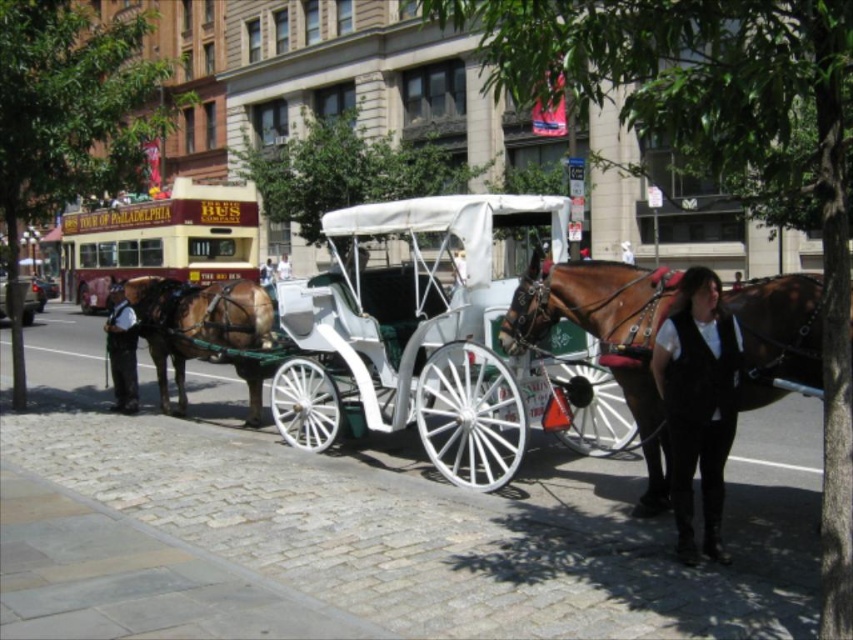
Is point (728, 381) more distant than point (248, 403)?

No, it is in front of (248, 403).

Which is above, white polished wood coach at center or brown glossy horse at left?

Positioned higher is white polished wood coach at center.

Is point (712, 397) closer to viewer compared to point (209, 292)?

Yes, point (712, 397) is closer to viewer.

Identify the location of white polished wood coach at center. The width and height of the screenshot is (853, 640). (698, 403).

Can you confirm if brown glossy horse at center is positioned to the left of white polished wood coach at center?

No, brown glossy horse at center is not to the left of white polished wood coach at center.

Does brown glossy horse at center come in front of white polished wood coach at center?

No, it is behind white polished wood coach at center.

Who is more forward, (573, 280) or (733, 339)?

Point (733, 339) is more forward.

Locate an element on the screen. The height and width of the screenshot is (640, 853). brown glossy horse at center is located at coordinates (606, 339).

Is white polished wood horse cart at center closer to camera compared to brown glossy horse at left?

Yes, it is in front of brown glossy horse at left.

Is white polished wood horse cart at center to the right of brown glossy horse at left from the viewer's perspective?

Indeed, white polished wood horse cart at center is positioned on the right side of brown glossy horse at left.

Find the location of a particular element. This screenshot has width=853, height=640. white polished wood horse cart at center is located at coordinates (393, 336).